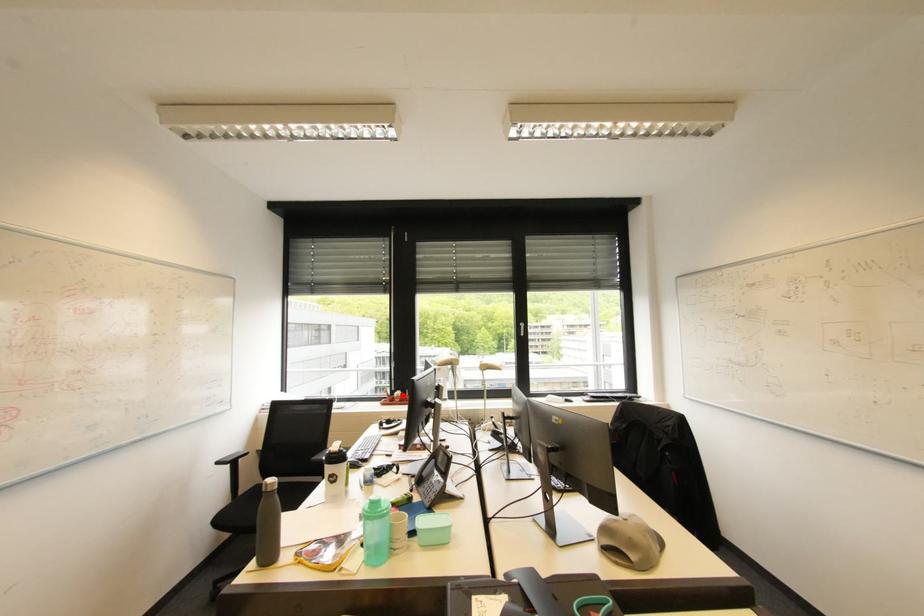
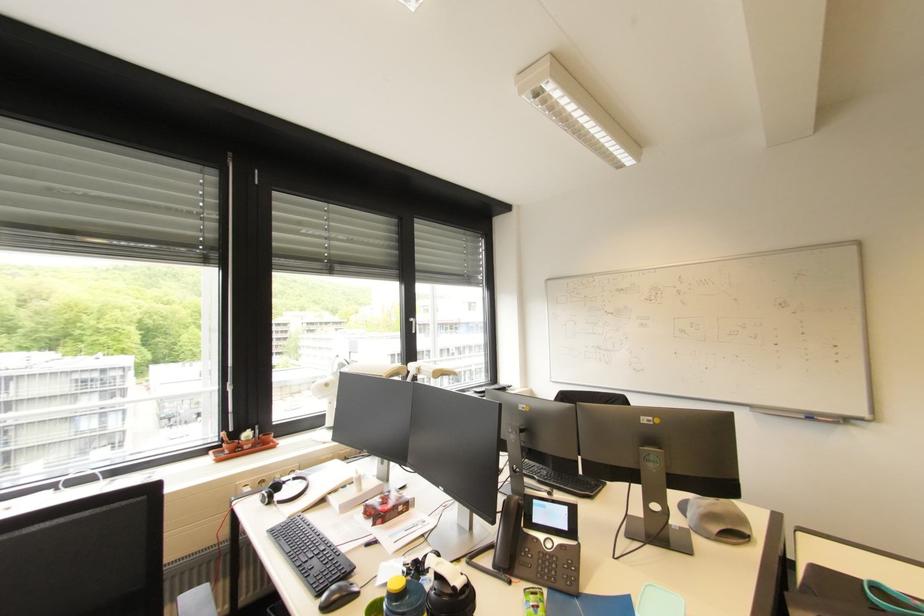
Where in the second image is the point corresponding to the highlighted location from the first image?

(252, 438)